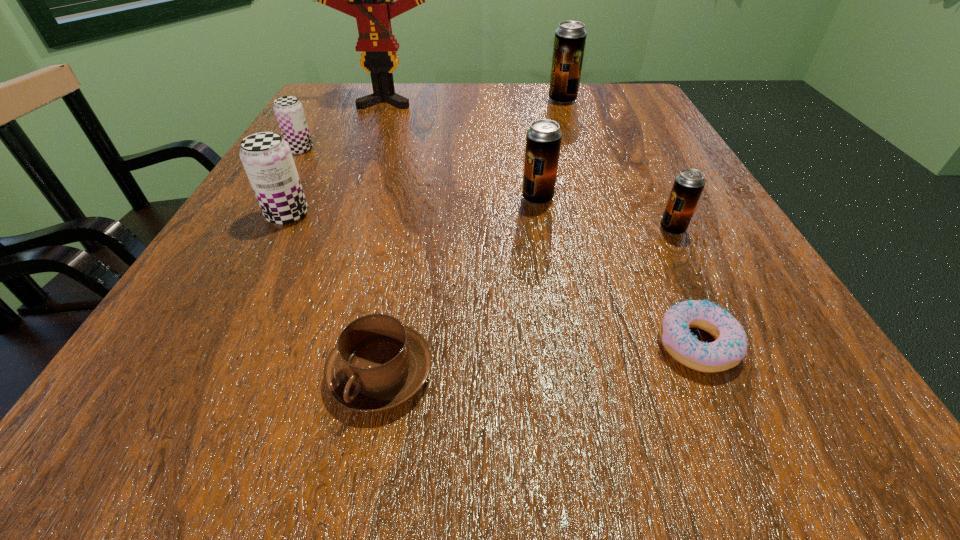
Where is `the tallest object`? the tallest object is located at coordinates pos(370,0).

Where is `the farthest beer can`? This screenshot has height=540, width=960. the farthest beer can is located at coordinates (570, 37).

The height and width of the screenshot is (540, 960). In order to click on the farthest black beer can in this screenshot , I will do `click(570, 37)`.

Where is `the fifth object from left to right`? the fifth object from left to right is located at coordinates (543, 139).

This screenshot has height=540, width=960. What are the coordinates of `the second smallest black beer can` in the screenshot? It's located at (543, 139).

The height and width of the screenshot is (540, 960). What are the coordinates of `the nearer purple beer can` in the screenshot? It's located at (267, 159).

Find the location of a particular element. the smaller purple beer can is located at coordinates (289, 113).

Locate an element on the screen. the second farthest beer can is located at coordinates (289, 113).

Where is `the smallest black beer can`? The width and height of the screenshot is (960, 540). the smallest black beer can is located at coordinates (688, 185).

Image resolution: width=960 pixels, height=540 pixels. Identify the location of the rightmost black beer can. (688, 185).